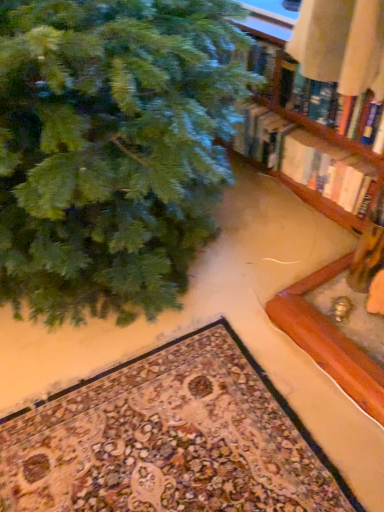
Question: Does wooden bookshelf at upper right have a greater height compared to hardcover book at upper right?

Choices:
 (A) no
 (B) yes

Answer: (B)

Question: Is wooden bookshelf at upper right turned away from hardcover book at upper right?

Choices:
 (A) yes
 (B) no

Answer: (B)

Question: From a real-world perspective, does wooden bookshelf at upper right stand above hardcover book at upper right?

Choices:
 (A) no
 (B) yes

Answer: (B)

Question: Is wooden bookshelf at upper right oriented towards hardcover book at upper right?

Choices:
 (A) no
 (B) yes

Answer: (A)

Question: Can you confirm if wooden bookshelf at upper right is shorter than hardcover book at upper right?

Choices:
 (A) no
 (B) yes

Answer: (A)

Question: Considering the relative positions of carpeted mat at lower center and hardcover book at upper right in the image provided, is carpeted mat at lower center to the left or to the right of hardcover book at upper right?

Choices:
 (A) right
 (B) left

Answer: (B)

Question: Is carpeted mat at lower center taller or shorter than hardcover book at upper right?

Choices:
 (A) tall
 (B) short

Answer: (B)

Question: Considering the positions of point (23, 482) and point (322, 161), is point (23, 482) closer or farther from the camera than point (322, 161)?

Choices:
 (A) closer
 (B) farther

Answer: (A)

Question: Relative to hardcover book at upper right, is carpeted mat at lower center in front or behind?

Choices:
 (A) front
 (B) behind

Answer: (A)

Question: Is green matte christmas tree at upper left spatially inside wooden bookshelf at upper right, or outside of it?

Choices:
 (A) outside
 (B) inside

Answer: (A)

Question: From a real-world perspective, is green matte christmas tree at upper left physically located above or below wooden bookshelf at upper right?

Choices:
 (A) above
 (B) below

Answer: (A)

Question: Looking at the image, does green matte christmas tree at upper left seem bigger or smaller compared to wooden bookshelf at upper right?

Choices:
 (A) small
 (B) big

Answer: (B)

Question: From the image's perspective, is green matte christmas tree at upper left above or below wooden bookshelf at upper right?

Choices:
 (A) above
 (B) below

Answer: (B)

Question: In terms of size, does carpeted mat at lower center appear bigger or smaller than wooden bookshelf at upper right?

Choices:
 (A) small
 (B) big

Answer: (B)

Question: Considering the relative positions of carpeted mat at lower center and wooden bookshelf at upper right in the image provided, is carpeted mat at lower center to the left or to the right of wooden bookshelf at upper right?

Choices:
 (A) right
 (B) left

Answer: (B)